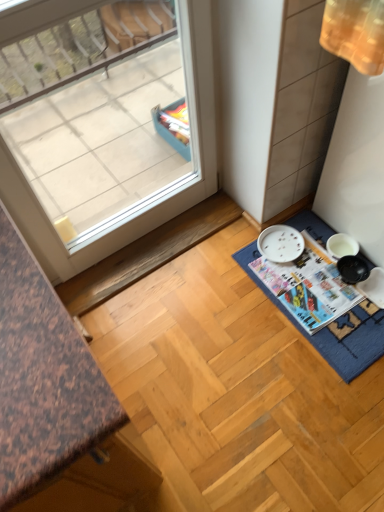
Question: Considering the relative sizes of blue fabric bath mat at lower right and transparent glass window at upper left in the image provided, is blue fabric bath mat at lower right shorter than transparent glass window at upper left?

Choices:
 (A) no
 (B) yes

Answer: (B)

Question: Is transparent glass window at upper left surrounded by blue fabric bath mat at lower right?

Choices:
 (A) no
 (B) yes

Answer: (A)

Question: Is blue fabric bath mat at lower right far from transparent glass window at upper left?

Choices:
 (A) no
 (B) yes

Answer: (A)

Question: From a real-world perspective, is blue fabric bath mat at lower right over transparent glass window at upper left?

Choices:
 (A) yes
 (B) no

Answer: (B)

Question: Is blue fabric bath mat at lower right turned away from transparent glass window at upper left?

Choices:
 (A) yes
 (B) no

Answer: (B)

Question: From the image's perspective, would you say blue fabric bath mat at lower right is positioned over transparent glass window at upper left?

Choices:
 (A) yes
 (B) no

Answer: (B)

Question: From a real-world perspective, is blue fabric bath mat at lower right positioned over white glossy magazine at lower right based on gravity?

Choices:
 (A) no
 (B) yes

Answer: (A)

Question: Does blue fabric bath mat at lower right have a lesser height compared to white glossy magazine at lower right?

Choices:
 (A) yes
 (B) no

Answer: (A)

Question: Can you confirm if blue fabric bath mat at lower right is smaller than white glossy magazine at lower right?

Choices:
 (A) yes
 (B) no

Answer: (B)

Question: Would you say blue fabric bath mat at lower right contains white glossy magazine at lower right?

Choices:
 (A) no
 (B) yes

Answer: (B)

Question: Is blue fabric bath mat at lower right next to white glossy magazine at lower right and touching it?

Choices:
 (A) yes
 (B) no

Answer: (A)

Question: Is blue fabric bath mat at lower right turned away from white glossy magazine at lower right?

Choices:
 (A) no
 (B) yes

Answer: (B)

Question: Is white glossy magazine at lower right shorter than blue fabric bath mat at lower right?

Choices:
 (A) no
 (B) yes

Answer: (A)